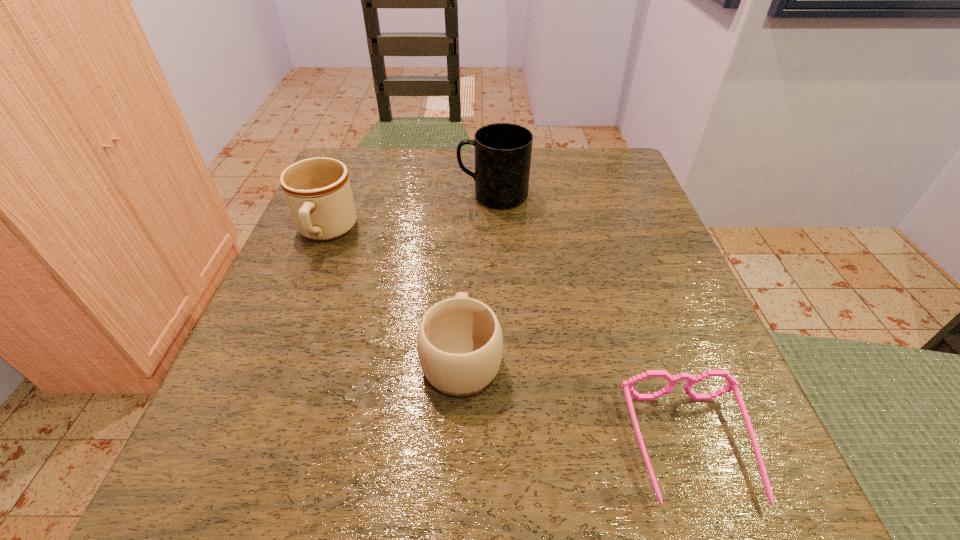
This screenshot has height=540, width=960. In order to click on the third shortest object in this screenshot , I will do `click(318, 192)`.

Image resolution: width=960 pixels, height=540 pixels. Find the location of `the leftmost mug`. the leftmost mug is located at coordinates (318, 192).

Locate an element on the screen. the nearest mug is located at coordinates (460, 344).

Where is `the shortest mug`? Image resolution: width=960 pixels, height=540 pixels. the shortest mug is located at coordinates (460, 344).

What are the coordinates of `the shortest object` in the screenshot? It's located at (627, 386).

Where is `spectacles`? The width and height of the screenshot is (960, 540). spectacles is located at coordinates (627, 386).

Locate an element on the screen. Image resolution: width=960 pixels, height=540 pixels. free location located on the side of the leftmost mug with the handle is located at coordinates (282, 340).

The width and height of the screenshot is (960, 540). I want to click on vacant position located 0.230m on the side of the shortest mug with the handle, so click(x=467, y=230).

You are a GUI agent. You are given a task and a screenshot of the screen. Output one action in this format:
    pyautogui.click(x=<x>, y=<y>)
    Task: Click on the free space located 0.210m on the side of the shortest mug with the handle
    
    Given the screenshot: What is the action you would take?
    pyautogui.click(x=466, y=236)

In order to click on vacant area situated 0.140m on the side of the shortest mug with the handle in this screenshot , I will do `click(466, 260)`.